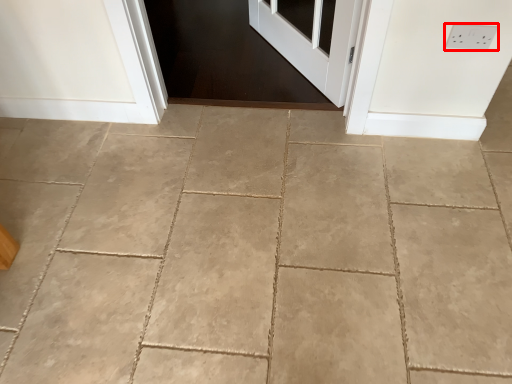
Question: From the image, what is the correct spatial relationship of electric outlet (annotated by the red box) in relation to concrete?

Choices:
 (A) right
 (B) left

Answer: (A)